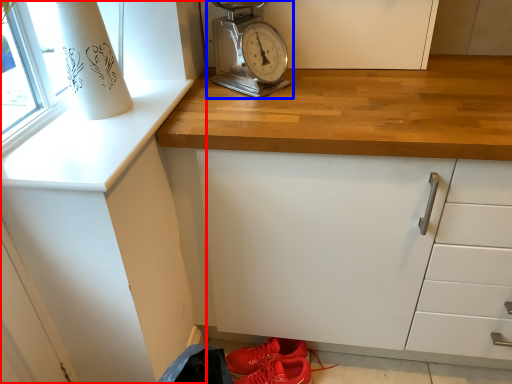
Question: Which point is closer to the camera, cabinetry (highlighted by a red box) or home appliance (highlighted by a blue box)?

Choices:
 (A) cabinetry
 (B) home appliance

Answer: (A)